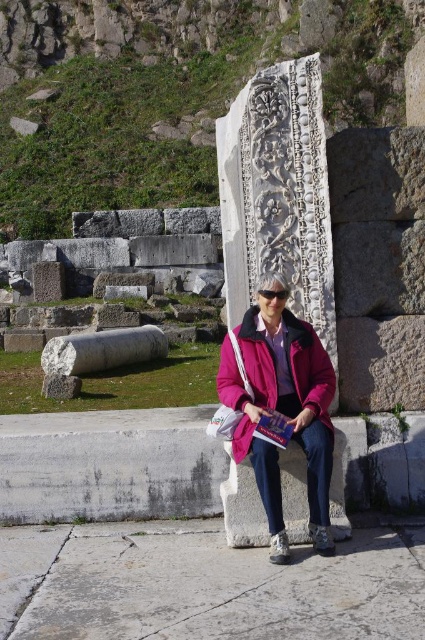
Which of these two, carved stone column at center or pink fabric jacket at center, stands taller?

Standing taller between the two is carved stone column at center.

Can you confirm if carved stone column at center is taller than pink fabric jacket at center?

Correct, carved stone column at center is much taller as pink fabric jacket at center.

Is point (286, 145) positioned before point (300, 371)?

No, it is not.

The width and height of the screenshot is (425, 640). Identify the location of carved stone column at center. (277, 195).